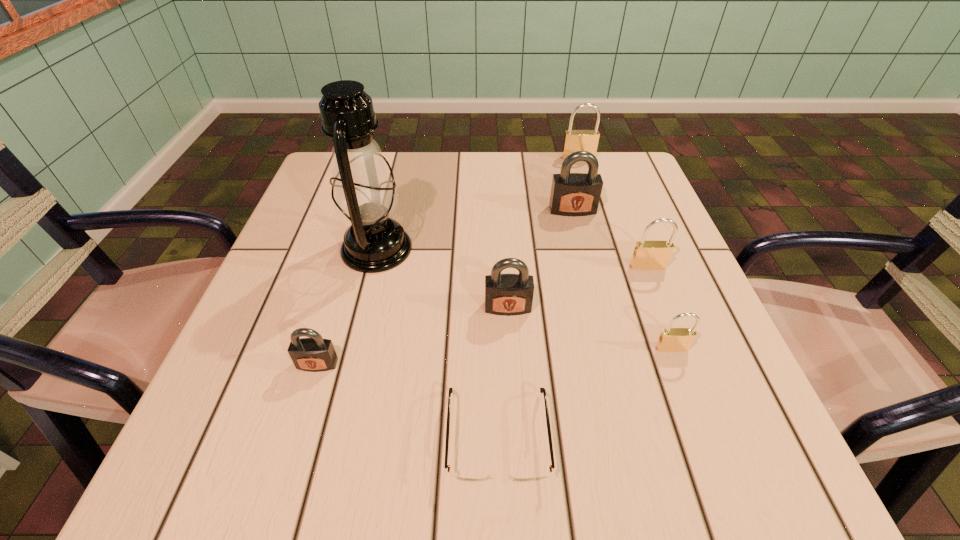
What are the coordinates of `the tallest object` in the screenshot? It's located at (364, 194).

Identify the location of oil lamp. The image size is (960, 540). (364, 194).

The width and height of the screenshot is (960, 540). In order to click on the farthest object in this screenshot , I will do click(575, 140).

The image size is (960, 540). Identify the location of the farthest padlock. tap(575, 140).

Where is `the fifth nearest padlock`? the fifth nearest padlock is located at coordinates (572, 194).

Image resolution: width=960 pixels, height=540 pixels. I want to click on the rightmost gray padlock, so click(x=572, y=194).

The width and height of the screenshot is (960, 540). I want to click on the fourth nearest object, so [508, 294].

Find the location of a particular element. This screenshot has width=960, height=540. the fifth padlock from right to left is located at coordinates (508, 294).

The image size is (960, 540). I want to click on the second farthest brass padlock, so click(x=648, y=255).

In order to click on the second biggest brass padlock in this screenshot , I will do `click(648, 255)`.